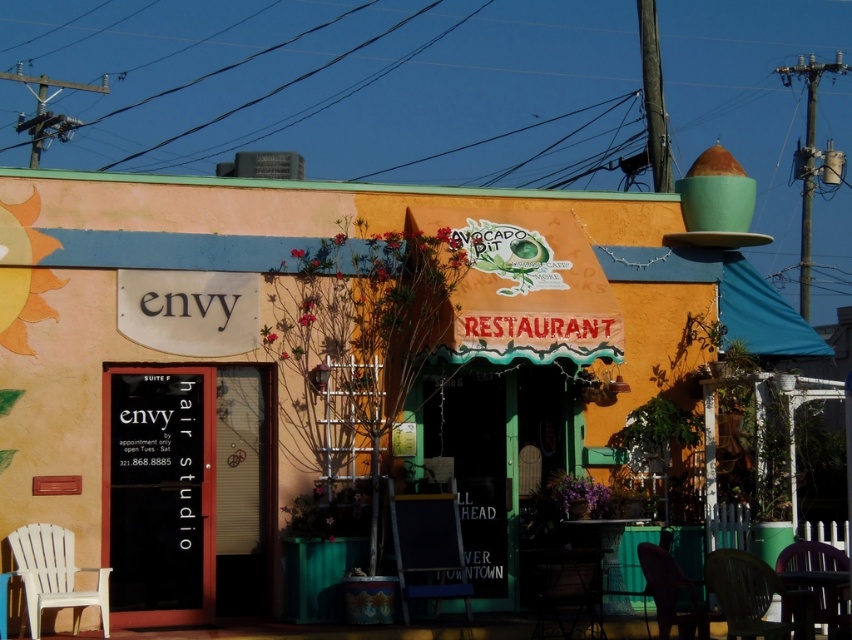
Can you confirm if black plastic chair at center is smaller than green plastic chair at lower right?

No, black plastic chair at center is not smaller than green plastic chair at lower right.

Is black plastic chair at center to the right of green plastic chair at lower right from the viewer's perspective?

No, black plastic chair at center is not to the right of green plastic chair at lower right.

Does point (430, 596) come closer to viewer compared to point (758, 624)?

No, it is not.

At what (x,y) coordinates should I click in order to perform the action: click on black plastic chair at center. Please return your answer as a coordinate pair (x, y). The image size is (852, 640). Looking at the image, I should click on (429, 545).

Consider the image. Is the position of metallic dark brown chair at lower center more distant than that of plastic chair at lower right?

Yes, metallic dark brown chair at lower center is further from the viewer.

Between metallic dark brown chair at lower center and plastic chair at lower right, which one is positioned higher?

plastic chair at lower right

Does point (536, 596) come behind point (665, 609)?

Yes.

At what (x,y) coordinates should I click in order to perform the action: click on metallic dark brown chair at lower center. Please return your answer as a coordinate pair (x, y). The image size is (852, 640). Looking at the image, I should click on (567, 593).

Is green plastic chair at lower right taller than white plastic chair at lower left?

In fact, green plastic chair at lower right may be shorter than white plastic chair at lower left.

Identify the location of green plastic chair at lower right. (753, 596).